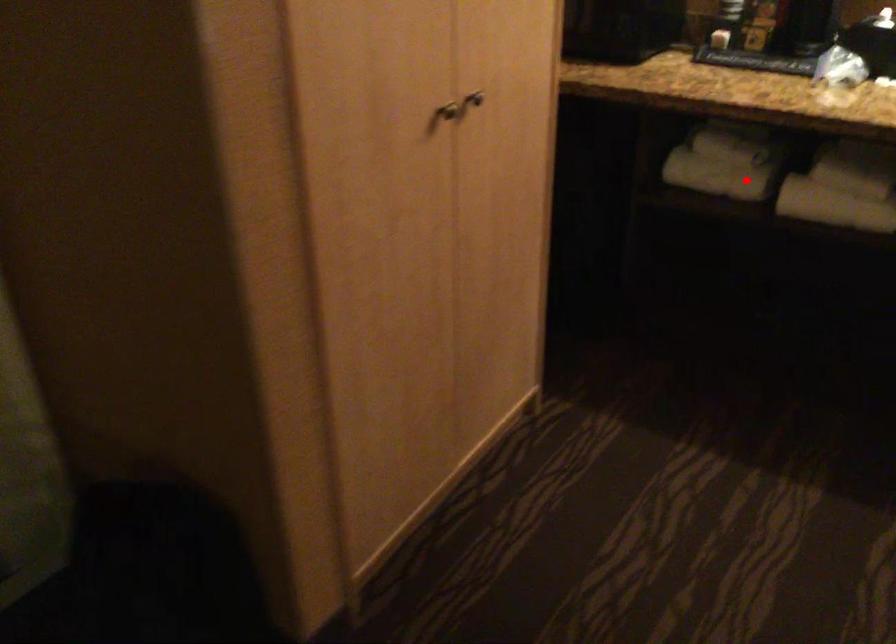
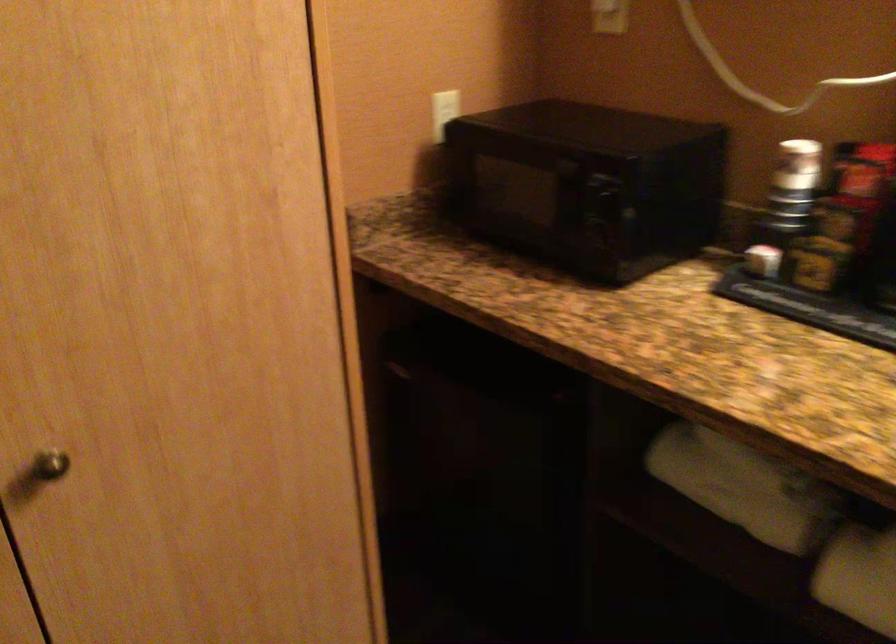
Question: I am providing you with two images of the same scene from different viewpoints. In image1, a red point is highlighted. Considering the same 3D point in image2, which of the following is correct?

Choices:
 (A) It is closer
 (B) It is farther

Answer: (A)